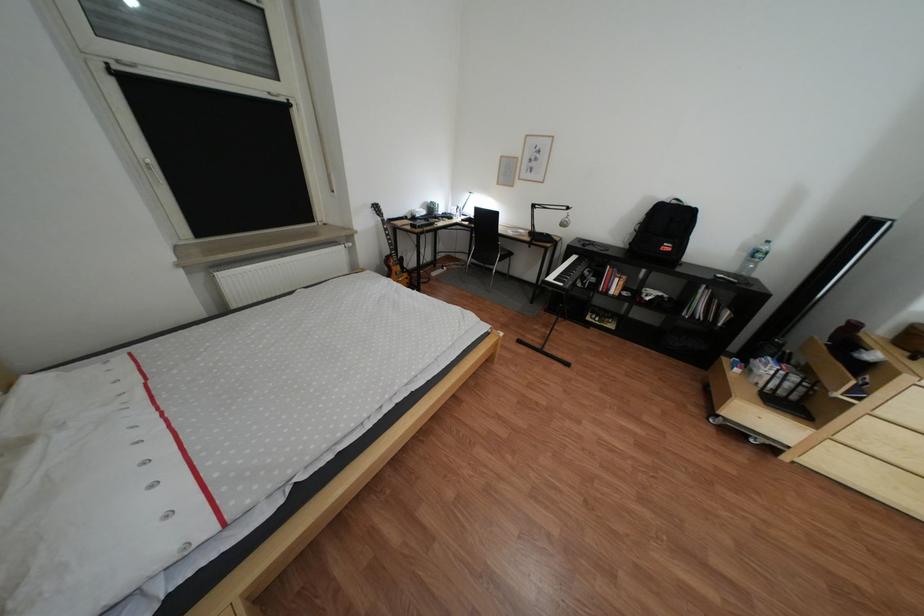
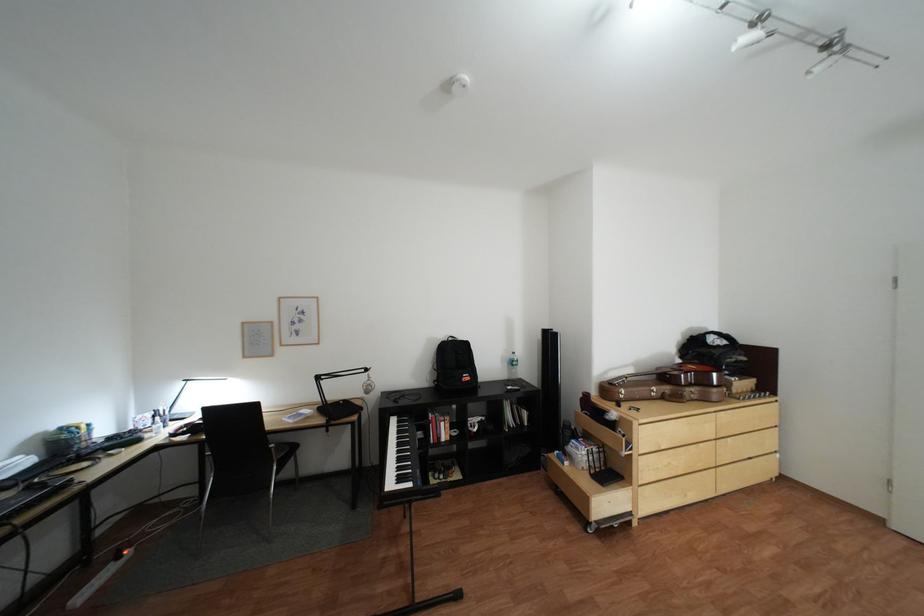
Where in the second image is the point corresponding to the point at 689,203 from the first image?

(466, 339)